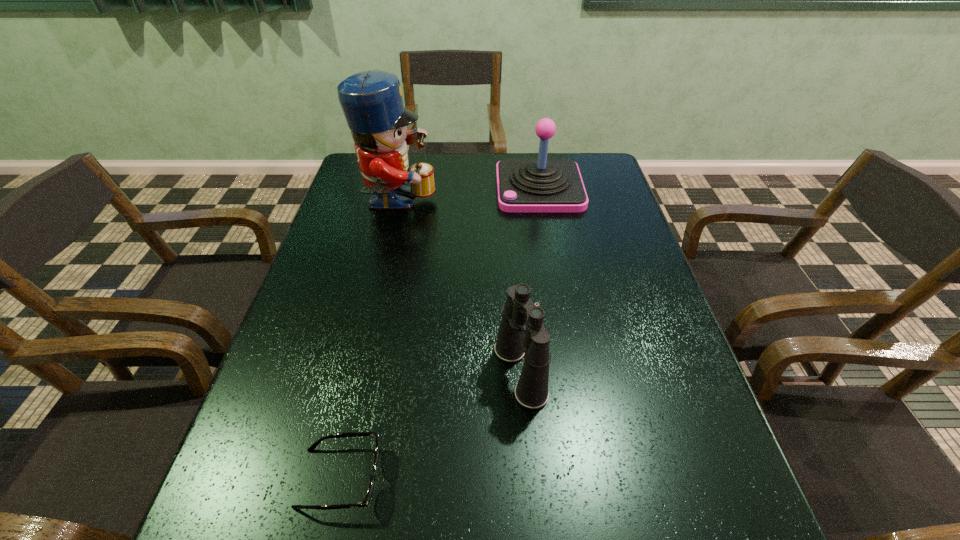
I want to click on the tallest object, so click(372, 103).

Where is `joystick`? This screenshot has height=540, width=960. joystick is located at coordinates (542, 185).

Identify the location of binoculars. The image size is (960, 540). (522, 333).

Locate an element on the screen. The width and height of the screenshot is (960, 540). the shortest object is located at coordinates (365, 503).

Where is `the nearest object`? the nearest object is located at coordinates (365, 503).

The image size is (960, 540). Identify the location of free space located 0.320m on the front-facing side of the nutcracker. (540, 204).

In order to click on free spot located forward from the base of the joystick in this screenshot , I will do `click(444, 188)`.

The image size is (960, 540). What are the coordinates of `free location located forward from the base of the joystick` in the screenshot? It's located at (435, 188).

Identify the location of vacant space situated 0.300m forward from the base of the joystick. This screenshot has height=540, width=960. (403, 188).

The width and height of the screenshot is (960, 540). In order to click on free space located 0.100m on the left of the third farthest object in this screenshot , I will do `click(446, 372)`.